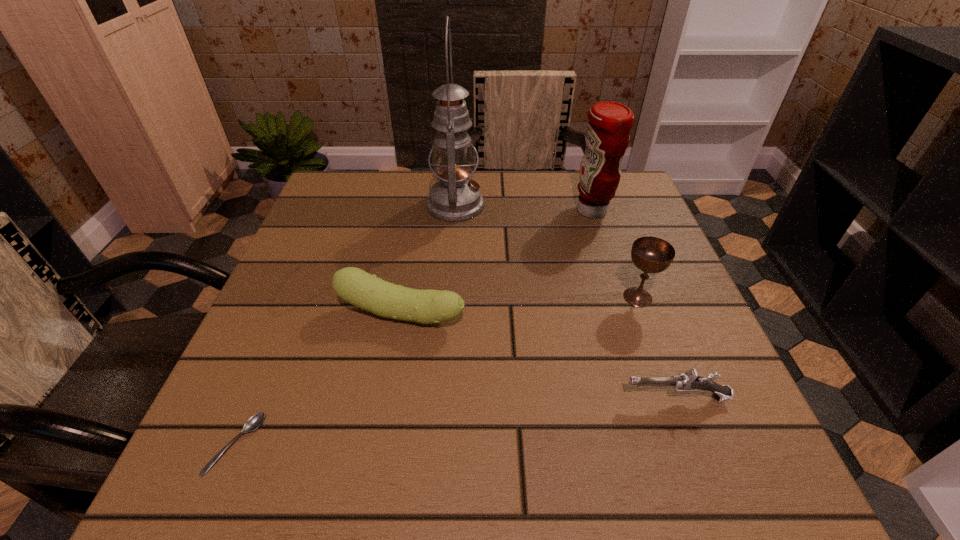
Find the location of `vacant space at the far left corner`. vacant space at the far left corner is located at coordinates (332, 177).

The height and width of the screenshot is (540, 960). In order to click on blank space at the near left corner of the desktop in this screenshot , I will do `click(258, 435)`.

Where is `free space at the near right corner of the desktop`? The height and width of the screenshot is (540, 960). free space at the near right corner of the desktop is located at coordinates (766, 498).

The height and width of the screenshot is (540, 960). In order to click on free space between the gun and the tallest object in this screenshot , I will do `click(565, 301)`.

Identify the location of vacant space that's between the fifth farthest object and the shortest object. Image resolution: width=960 pixels, height=540 pixels. (456, 421).

Where is `free space between the soupspoon and the condiment`? free space between the soupspoon and the condiment is located at coordinates (414, 327).

The width and height of the screenshot is (960, 540). In order to click on unoccupied position between the second shortest object and the chalice in this screenshot , I will do `click(657, 347)`.

Identify the location of free space between the fourth tallest object and the oil lamp. Image resolution: width=960 pixels, height=540 pixels. (428, 260).

You are a GUI agent. You are given a task and a screenshot of the screen. Output one action in this format:
    pyautogui.click(x=<x>, y=<y>)
    Task: Click on the free space that is in between the leftmost object and the third shortest object
    
    Given the screenshot: What is the action you would take?
    pyautogui.click(x=319, y=379)

Locate an element on the screen. The width and height of the screenshot is (960, 540). vacant space that's between the fifth shortest object and the tallest object is located at coordinates (524, 208).